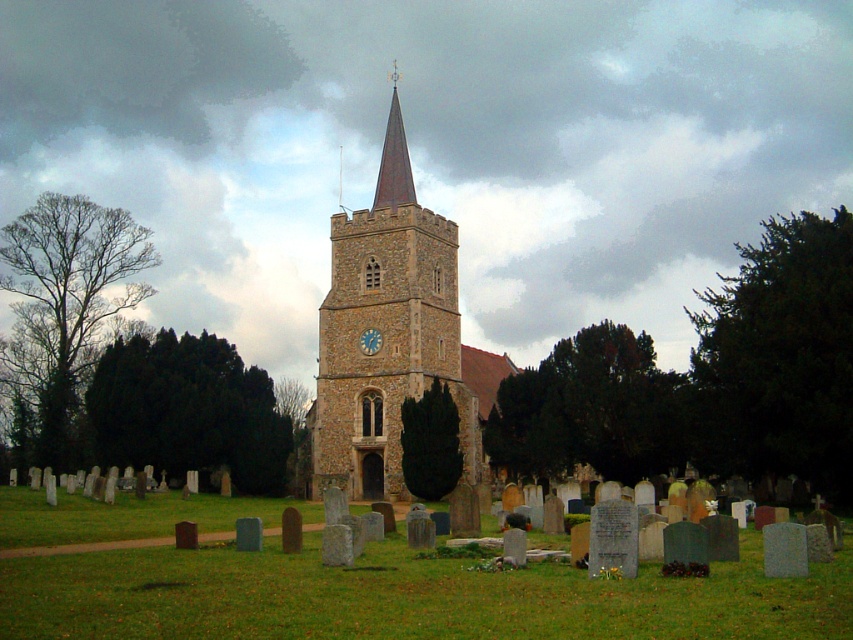
Who is shorter, green grassy at lower center or brown stone clock tower at center?

green grassy at lower center is shorter.

What do you see at coordinates (407, 596) in the screenshot? This screenshot has height=640, width=853. I see `green grassy at lower center` at bounding box center [407, 596].

Between point (195, 580) and point (437, 358), which one is positioned behind?

Point (437, 358)

At what (x,y) coordinates should I click in order to perform the action: click on green grassy at lower center. Please return your answer as a coordinate pair (x, y). This screenshot has width=853, height=640. Looking at the image, I should click on (407, 596).

Between smooth red steeple at center and blue painted clock face at center, which one is positioned higher?

smooth red steeple at center is above.

Who is more distant from viewer, (395, 84) or (360, 337)?

Point (395, 84)

This screenshot has width=853, height=640. Find the location of `smooth red steeple at center`. smooth red steeple at center is located at coordinates (393, 160).

Does brown stone clock tower at center have a greater height compared to smooth red steeple at center?

Yes.

You are a GUI agent. You are given a task and a screenshot of the screen. Output one action in this format:
    pyautogui.click(x=<x>, y=<y>)
    Task: Click on the brown stone clock tower at center
    This screenshot has height=640, width=853.
    Given the screenshot: What is the action you would take?
    pyautogui.click(x=387, y=333)

This screenshot has width=853, height=640. I want to click on brown stone clock tower at center, so click(387, 333).

Where is `brown stone clock tower at center`? This screenshot has height=640, width=853. brown stone clock tower at center is located at coordinates (387, 333).